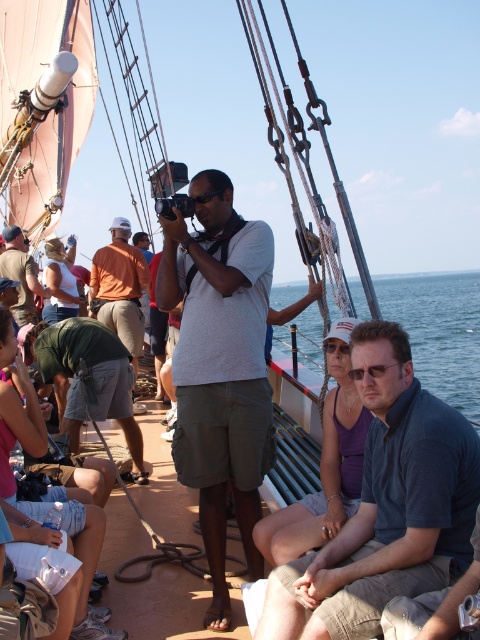
You are standing on the deck of the sailboat and want to take a photo of two specific points. The first point is located at coordinates point (134, 317) and the second point is at point (12, 268). Since you want to ensure both points are in focus, which point should you focus on first to make sure the other is also in focus?

You should focus on point (12, 268) first because it is farther from the camera than point (134, 317). By focusing on the farther point, the closer point will also be within the depth of field, ensuring both are in focus.

You are a photographer trying to capture two people on the deck of a sailboat. You see the matte gray shirt at center and the orange cotton shirt at center. Which one is more to the right?

The matte gray shirt at center is positioned on the right side of orange cotton shirt at center, so the matte gray shirt at center is more to the right.

You are a photographer trying to capture the scene on the deck of the sailboat. You notice the dark gray shirt at center and the matte black camera at center. Which object is positioned lower from your viewpoint?

The dark gray shirt at center is located below the matte black camera at center, so it is positioned lower from your viewpoint.